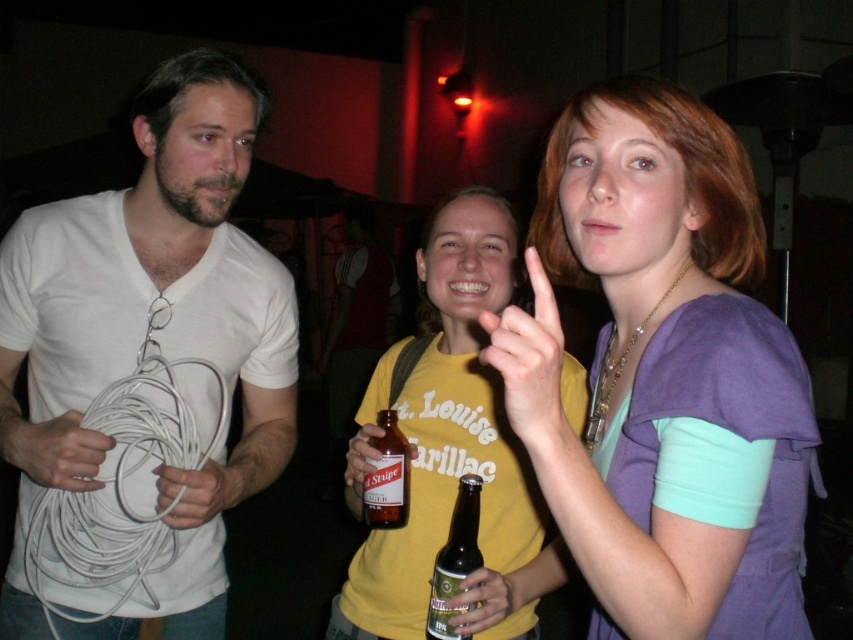
You are at a party and see two bottles, a green glass bottle at center and a brown glass bottle at center. Which one is taller?

The green glass bottle at center is taller than the brown glass bottle at center.